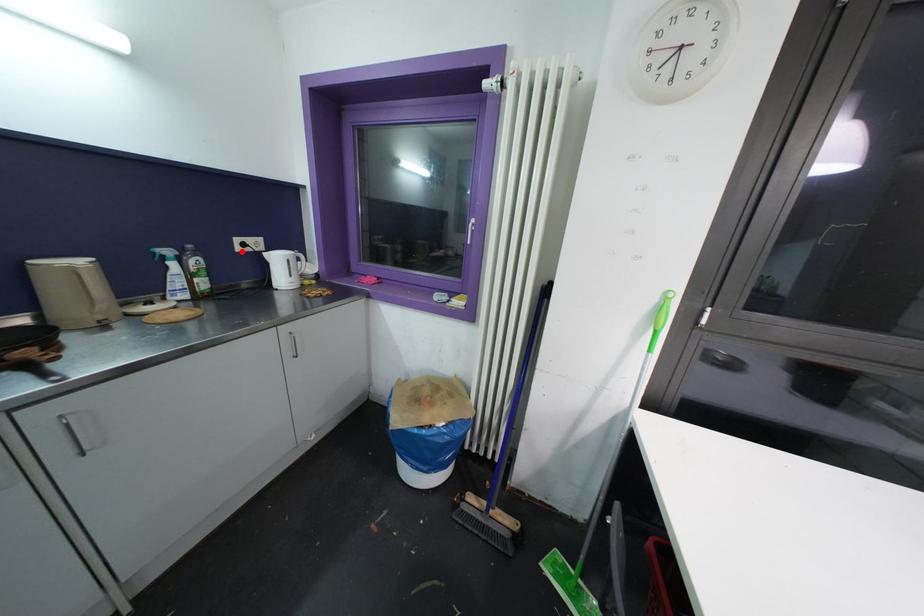
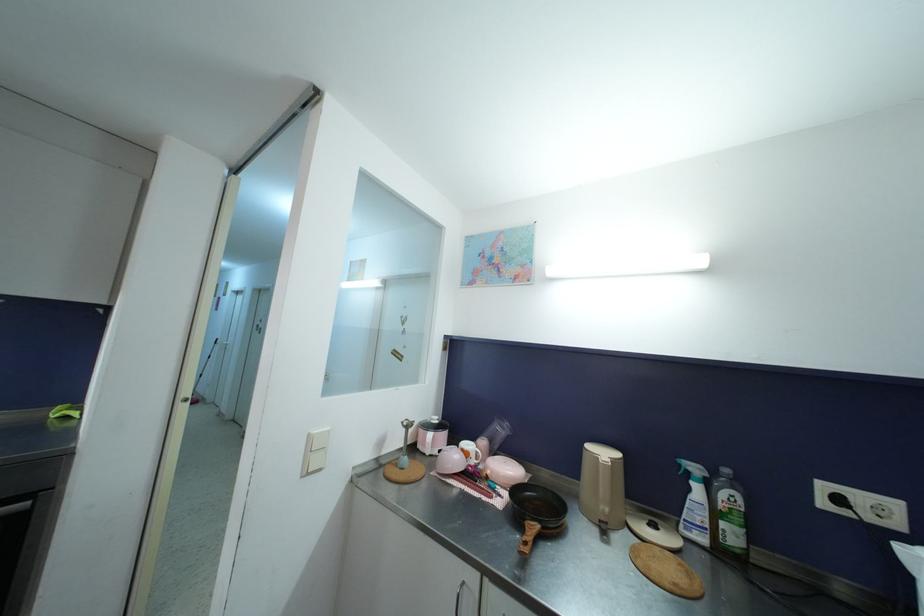
In the second image, find the point that corresponds to the highlighted location in the first image.

(827, 507)